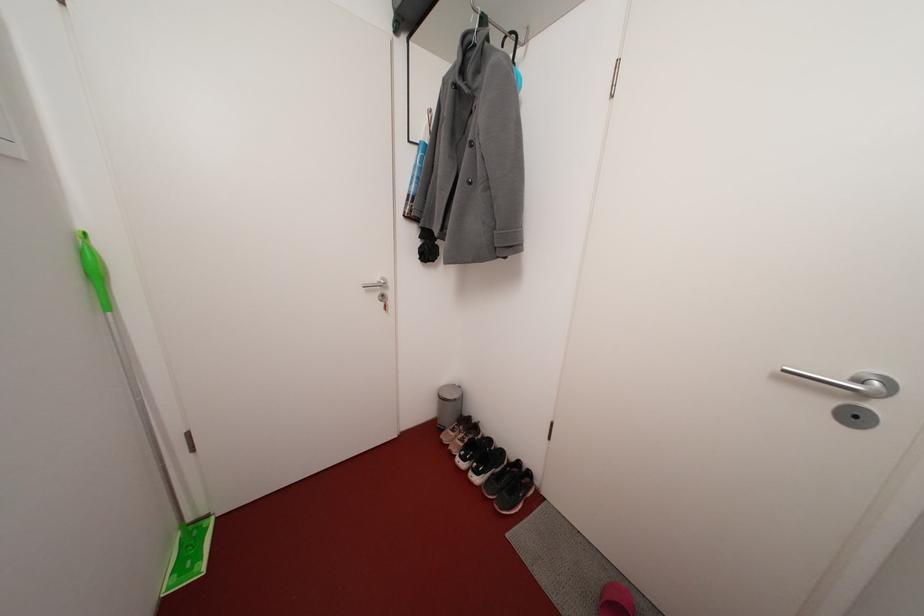
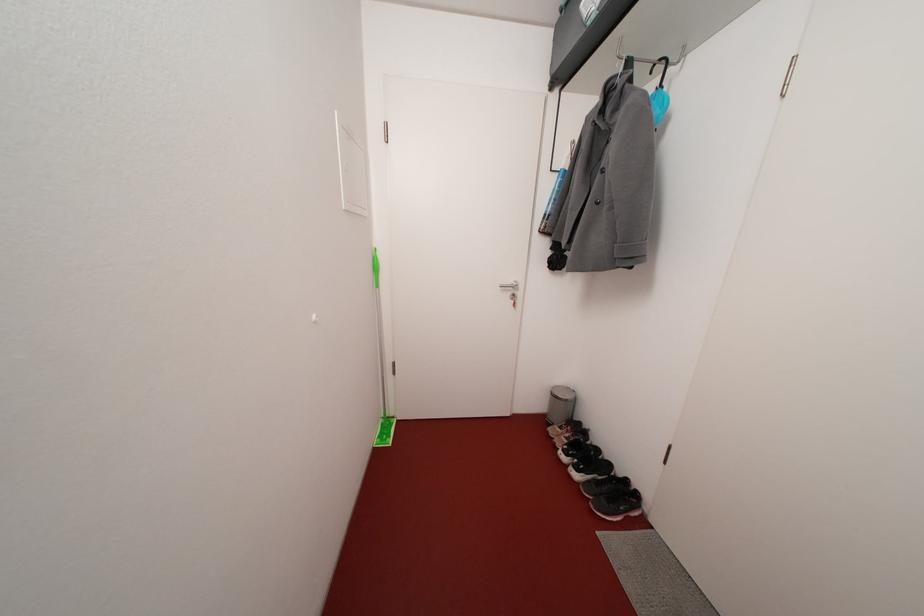
Where in the second image is the point corresponding to point (487, 493) from the first image?

(585, 488)